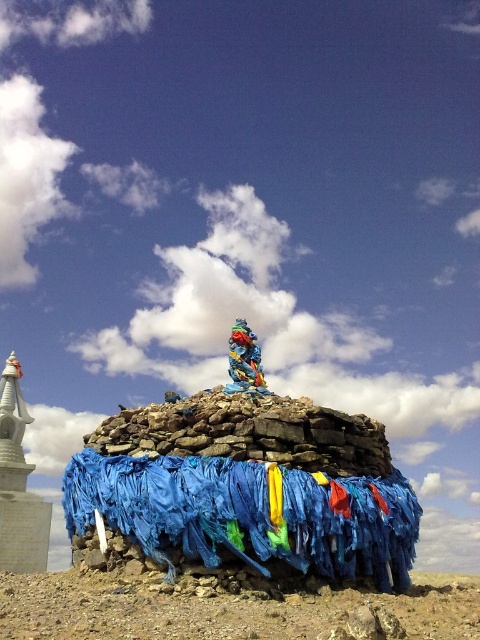
You are standing at the base of the large stone cairn and want to take a photo of the colorful sculpture on top. If you move forward 10 meters towards the point at coordinates point [184,552], will you be closer to the sculpture than before?

Moving forward 10 meters towards the point [184,552] would bring you closer to the sculpture since the original distance from the camera to that point is 36.03 meters, so moving 10 meters towards it reduces the distance to 26.03 meters.

You are a photographer planning to capture the blue fabric at center and the white glossy stupa at left in a single frame. Based on their heights, which object should you position closer to the camera to ensure both are fully visible in the photo?

Since the blue fabric at center is shorter than the white glossy stupa at left, you should position the white glossy stupa at left closer to the camera to ensure both are fully visible in the photo.